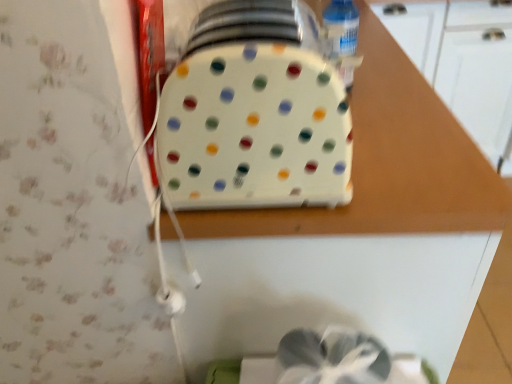
This screenshot has width=512, height=384. What do you see at coordinates (254, 130) in the screenshot?
I see `white plastic toaster at center` at bounding box center [254, 130].

Find the location of `white plastic toaster at center`. white plastic toaster at center is located at coordinates (254, 130).

What do you see at coordinates (341, 26) in the screenshot? I see `clear plastic bottle at upper right` at bounding box center [341, 26].

Where is `white plastic toaster at center`? This screenshot has height=384, width=512. white plastic toaster at center is located at coordinates click(254, 130).

Is clear plastic bottle at upper right thinner than white plastic toaster at center?

Yes, clear plastic bottle at upper right is thinner than white plastic toaster at center.

Looking at this image, which of these two, clear plastic bottle at upper right or white plastic toaster at center, is bigger?

With larger size is white plastic toaster at center.

Does clear plastic bottle at upper right have a greater height compared to white plastic toaster at center?

No.

Can you tell me how much clear plastic bottle at upper right and white plastic toaster at center differ in facing direction?

2.05 degrees.

From the image's perspective, which one is positioned higher, white plastic toaster at center or clear plastic bottle at upper right?

clear plastic bottle at upper right is shown above in the image.

Locate an element on the screen. bottle that is above the white plastic toaster at center (from the image's perspective) is located at coordinates (341, 26).

From their relative heights in the image, would you say white plastic toaster at center is taller or shorter than clear plastic bottle at upper right?

In the image, white plastic toaster at center appears to be taller than clear plastic bottle at upper right.

Is white plastic toaster at center oriented away from clear plastic bottle at upper right?

No.

Is white plastic tray at center oriented towards clear plastic bottle at upper right?

No, white plastic tray at center is not turned towards clear plastic bottle at upper right.

Can you confirm if white plastic tray at center is thinner than clear plastic bottle at upper right?

Incorrect, the width of white plastic tray at center is not less than that of clear plastic bottle at upper right.

In the scene shown: Would you say clear plastic bottle at upper right is part of white plastic tray at center's contents?

No.

Does white plastic tray at center have a lesser height compared to clear plastic bottle at upper right?

Incorrect, the height of white plastic tray at center does not fall short of that of clear plastic bottle at upper right.

Which is more to the left, white plastic toaster at center or white plastic tray at center?

white plastic toaster at center is more to the left.

From the image's perspective, between white plastic toaster at center and white plastic tray at center, which one is located above?

white plastic toaster at center appears higher in the image.

I want to click on countertop below the white plastic toaster at center (from a real-world perspective), so click(358, 234).

Is clear plastic bottle at upper right aimed at white plastic tray at center?

No, clear plastic bottle at upper right is not oriented towards white plastic tray at center.

From a real-world perspective, is clear plastic bottle at upper right physically located above or below white plastic tray at center?

In terms of real-world spatial position, clear plastic bottle at upper right is above white plastic tray at center.

Could white plastic tray at center be considered to be inside clear plastic bottle at upper right?

Definitely not — white plastic tray at center is not inside clear plastic bottle at upper right.

Is point (339, 47) closer or farther from the camera than point (371, 43)?

Clearly, point (339, 47) is closer to the camera than point (371, 43).

Is point (476, 255) farther from camera compared to point (309, 160)?

That is True.

In the scene shown: Is white plastic tray at center outside of white plastic toaster at center?

Yes, white plastic tray at center is located beyond the bounds of white plastic toaster at center.

Is white plastic tray at center bigger than white plastic toaster at center?

Yes.

At what (x,y) coordinates should I click in order to perform the action: click on toaster on the left of clear plastic bottle at upper right. Please return your answer as a coordinate pair (x, y). Looking at the image, I should click on (254, 130).

Locate an element on the screen. The height and width of the screenshot is (384, 512). bottle located on the right of white plastic toaster at center is located at coordinates (341, 26).

Which object lies further to the anchor point white plastic tray at center, clear plastic bottle at upper right or white plastic toaster at center?

clear plastic bottle at upper right lies further to white plastic tray at center than the other object.

From the image, which object appears to be nearer to white plastic tray at center, white plastic toaster at center or clear plastic bottle at upper right?

Among the two, white plastic toaster at center is located nearer to white plastic tray at center.

When comparing their distances from white plastic toaster at center, does white plastic tray at center or clear plastic bottle at upper right seem closer?

white plastic tray at center is closer to white plastic toaster at center.

Estimate the real-world distances between objects in this image. Which object is further from clear plastic bottle at upper right, white plastic toaster at center or white plastic tray at center?

white plastic tray at center.

Looking at this image, looking at the image, which one is located further to white plastic toaster at center, clear plastic bottle at upper right or white plastic tray at center?

clear plastic bottle at upper right lies further to white plastic toaster at center than the other object.

When comparing their distances from clear plastic bottle at upper right, does white plastic tray at center or white plastic toaster at center seem further?

white plastic tray at center is positioned further to the anchor clear plastic bottle at upper right.

Where is `toaster that lies between clear plastic bottle at upper right and white plastic tray at center from top to bottom`? toaster that lies between clear plastic bottle at upper right and white plastic tray at center from top to bottom is located at coordinates (254, 130).